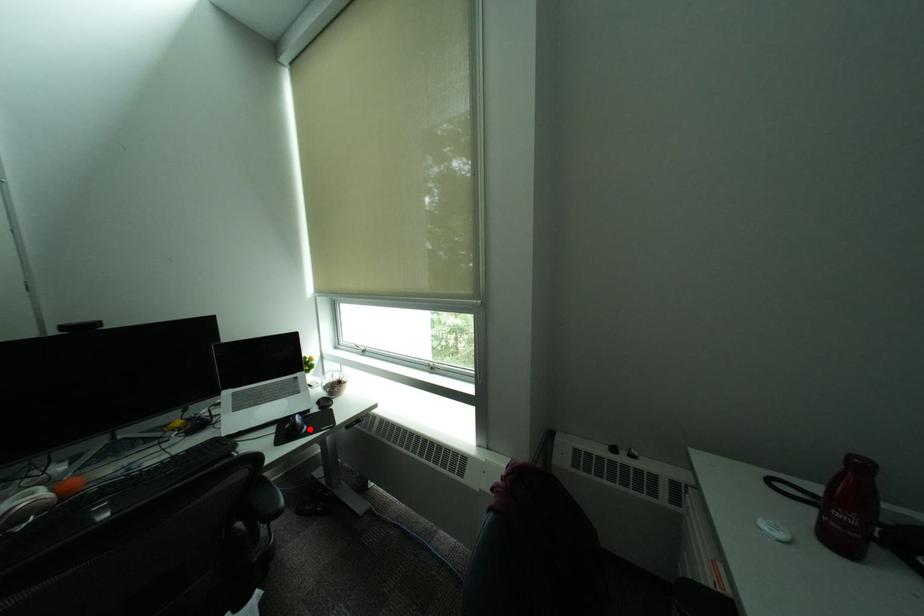
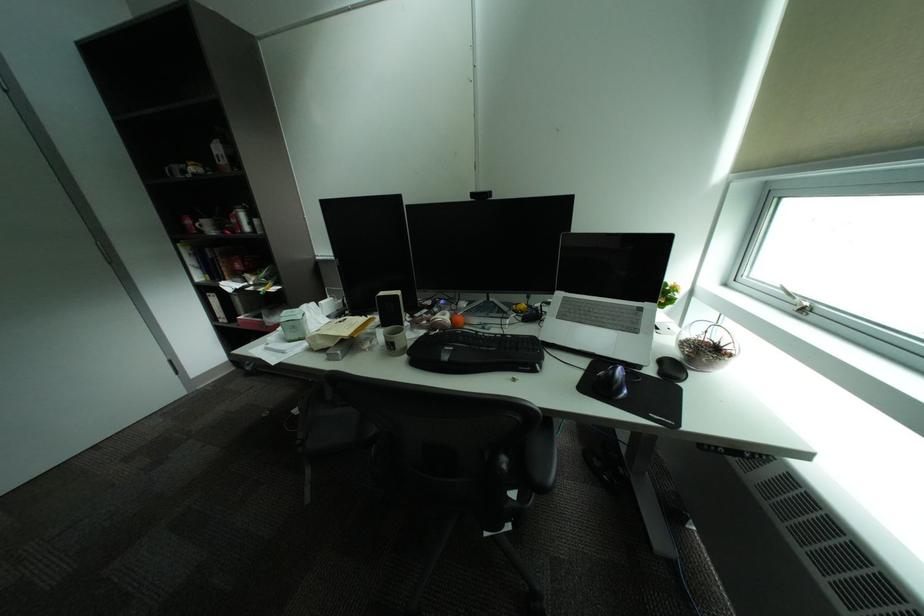
Locate, in the second image, the point that corresponds to the highlighted location in the first image.

(626, 389)